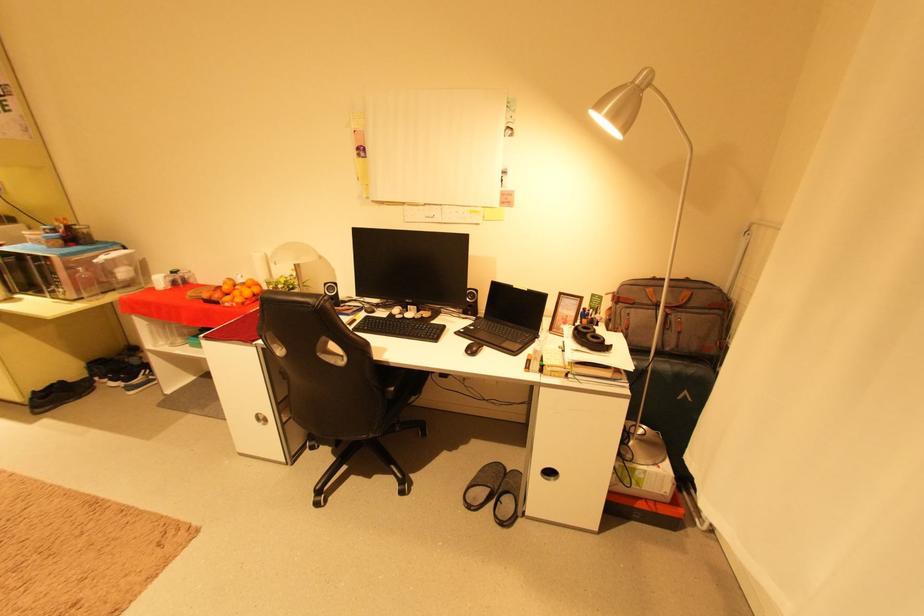
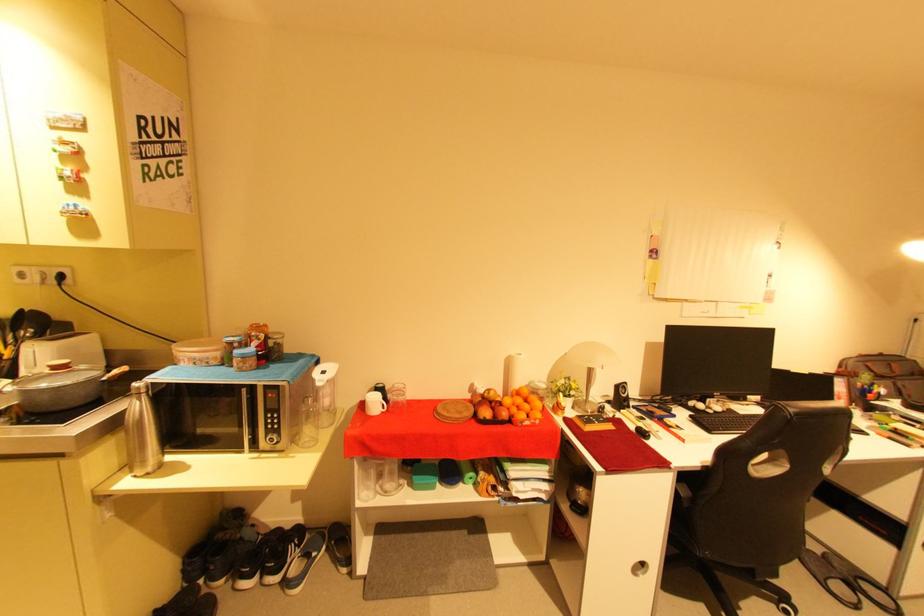
The point at (x=70, y=237) is marked in the first image. Where is the corresponding point in the second image?

(265, 352)